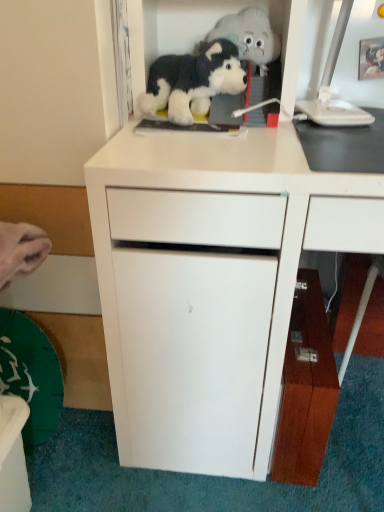
Question: Is white plastic computer monitor at upper right shorter than wooden cabinet at lower right, the second cabinetry viewed from the left?

Choices:
 (A) no
 (B) yes

Answer: (B)

Question: Can you confirm if white plastic computer monitor at upper right is bigger than wooden cabinet at lower right, the second cabinetry viewed from the left?

Choices:
 (A) no
 (B) yes

Answer: (A)

Question: Can you confirm if white plastic computer monitor at upper right is thinner than wooden cabinet at lower right, the second cabinetry viewed from the left?

Choices:
 (A) yes
 (B) no

Answer: (B)

Question: From the image's perspective, would you say white plastic computer monitor at upper right is positioned over wooden cabinet at lower right, arranged as the 1th cabinetry when viewed from the right?

Choices:
 (A) no
 (B) yes

Answer: (B)

Question: Does white plastic computer monitor at upper right have a smaller size compared to wooden cabinet at lower right, arranged as the 1th cabinetry when viewed from the right?

Choices:
 (A) no
 (B) yes

Answer: (B)

Question: From a real-world perspective, is white plastic computer monitor at upper right positioned under wooden cabinet at lower right, the second cabinetry viewed from the left, based on gravity?

Choices:
 (A) yes
 (B) no

Answer: (B)

Question: Is white matte cabinet at center, which is the 2th cabinetry from right to left, closer to the viewer compared to fluffy plush toy at upper center, marked as the 1th toy in a top-to-bottom arrangement?

Choices:
 (A) yes
 (B) no

Answer: (A)

Question: Is fluffy plush toy at upper center, marked as the 1th toy in a top-to-bottom arrangement, located within white matte cabinet at center, which is the 2th cabinetry from right to left?

Choices:
 (A) no
 (B) yes

Answer: (B)

Question: Does white matte cabinet at center, which is the 2th cabinetry from right to left, have a lesser height compared to fluffy plush toy at upper center, marked as the 1th toy in a top-to-bottom arrangement?

Choices:
 (A) no
 (B) yes

Answer: (A)

Question: From the image's perspective, is white matte cabinet at center, the first cabinetry when ordered from left to right, on fluffy plush toy at upper center, marked as the 1th toy in a top-to-bottom arrangement?

Choices:
 (A) yes
 (B) no

Answer: (B)

Question: Is white matte cabinet at center, which is the 2th cabinetry from right to left, looking in the opposite direction of fluffy plush toy at upper center, marked as the 1th toy in a top-to-bottom arrangement?

Choices:
 (A) yes
 (B) no

Answer: (B)

Question: Is white matte cabinet at center, which is the 2th cabinetry from right to left, thinner than fluffy plush toy at upper center, marked as the 1th toy in a top-to-bottom arrangement?

Choices:
 (A) yes
 (B) no

Answer: (B)

Question: From the image's perspective, is white plastic computer monitor at upper right located beneath black plush dog at upper center, placed as the 1th toy when sorted from bottom to top?

Choices:
 (A) yes
 (B) no

Answer: (B)